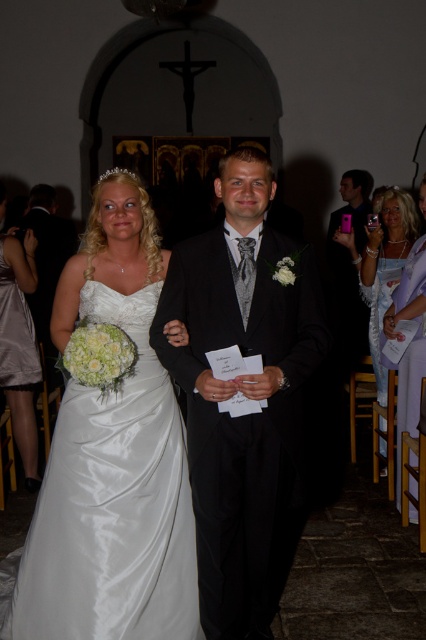
Between matte black suit at right and white satin dress at right, which one appears on the left side from the viewer's perspective?

white satin dress at right

Can you confirm if matte black suit at right is wider than white satin dress at right?

Indeed, matte black suit at right has a greater width compared to white satin dress at right.

The image size is (426, 640). What do you see at coordinates (350, 262) in the screenshot?
I see `matte black suit at right` at bounding box center [350, 262].

Where is `matte black suit at right`? The height and width of the screenshot is (640, 426). matte black suit at right is located at coordinates (350, 262).

Can you confirm if pearl necklace at upper right is positioned below white satin dress at right?

Incorrect, pearl necklace at upper right is not positioned below white satin dress at right.

Is pearl necklace at upper right shorter than white satin dress at right?

No.

Locate an element on the screen. pearl necklace at upper right is located at coordinates (382, 266).

Is black satin suit at center to the right of pearl necklace at upper right from the viewer's perspective?

Incorrect, black satin suit at center is not on the right side of pearl necklace at upper right.

Can you confirm if black satin suit at center is smaller than pearl necklace at upper right?

No, black satin suit at center is not smaller than pearl necklace at upper right.

This screenshot has width=426, height=640. Describe the element at coordinates (244, 394) in the screenshot. I see `black satin suit at center` at that location.

Where is `black satin suit at center`? black satin suit at center is located at coordinates (244, 394).